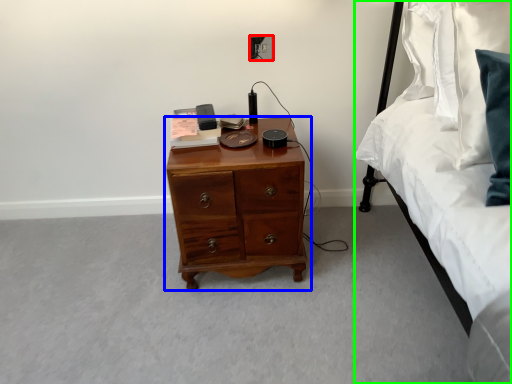
Question: Which object is the farthest from electric outlet (highlighted by a red box)? Choose among these: chest of drawers (highlighted by a blue box) or bed (highlighted by a green box).

Choices:
 (A) chest of drawers
 (B) bed

Answer: (B)